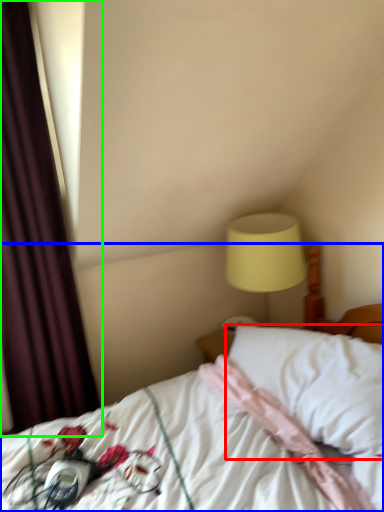
Question: Which object is positioned farthest from pillow (highlighted by a red box)? Select from bed (highlighted by a blue box) and curtain (highlighted by a green box).

Choices:
 (A) bed
 (B) curtain

Answer: (B)